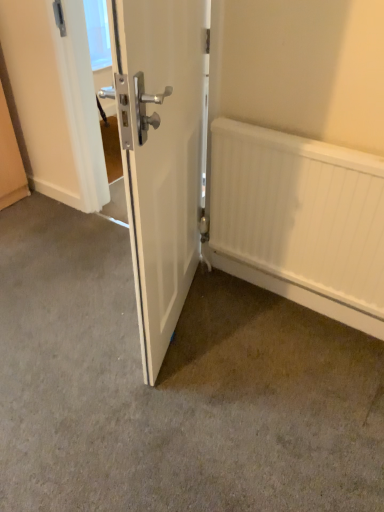
Question: Is white matte radiator at lower right spatially inside smooth concrete floor at center, or outside of it?

Choices:
 (A) outside
 (B) inside

Answer: (A)

Question: From a real-world perspective, is white matte radiator at lower right above or below smooth concrete floor at center?

Choices:
 (A) below
 (B) above

Answer: (B)

Question: Considering the real-world distances, which object is closest to the white matte radiator at lower right?

Choices:
 (A) white glossy door at center
 (B) smooth concrete floor at center

Answer: (A)

Question: Which object is positioned closest to the smooth concrete floor at center?

Choices:
 (A) white matte radiator at lower right
 (B) white glossy door at center

Answer: (B)